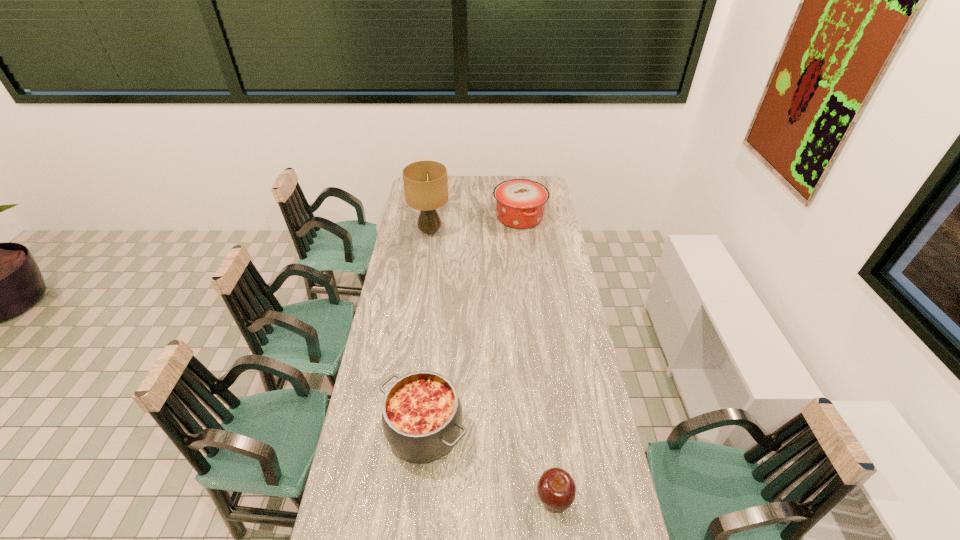
This screenshot has width=960, height=540. I want to click on lampshade located in the left edge section of the desktop, so click(x=425, y=182).

Find the location of a particular element. This screenshot has height=540, width=960. casserole located at the left edge is located at coordinates (421, 412).

Where is `casserole at the right edge`? casserole at the right edge is located at coordinates (520, 203).

Image resolution: width=960 pixels, height=540 pixels. In order to click on apple that is positioned at the right edge in this screenshot , I will do `click(556, 488)`.

Identify the location of free space at the far edge of the desktop. The width and height of the screenshot is (960, 540). (458, 187).

The width and height of the screenshot is (960, 540). Find the location of `vacant space at the left edge`. vacant space at the left edge is located at coordinates (392, 508).

Where is `free space at the right edge of the desktop`? This screenshot has width=960, height=540. free space at the right edge of the desktop is located at coordinates (621, 495).

The width and height of the screenshot is (960, 540). In order to click on free space at the far right corner of the desktop in this screenshot , I will do `click(526, 176)`.

At what (x,y) coordinates should I click in order to perform the action: click on vacant area that lies between the shortest object and the lampshade. Please return your answer as a coordinate pair (x, y). Image resolution: width=960 pixels, height=540 pixels. Looking at the image, I should click on (492, 364).

Identify the location of free area in between the apple and the left casserole. (490, 464).